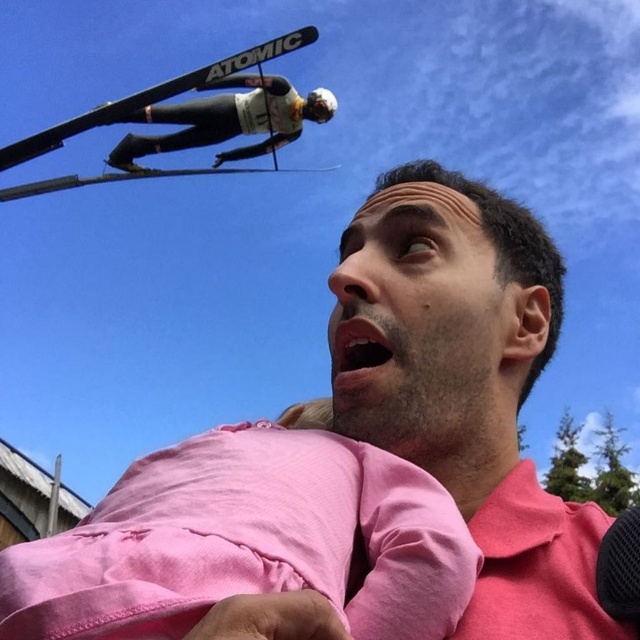
You are an observer looking at the image. You notice two items, the pink cotton shirt at center and the black matte ski suit at upper left. Which item appears narrower in the image?

The pink cotton shirt at center has a lesser width compared to the black matte ski suit at upper left, so it appears narrower.

You are a photographer trying to capture both the pink cotton shirt at center and the black matte ski suit at upper left in the same frame. Given that your camera has a maximum focus range of 30 feet, will you be able to focus on both subjects simultaneously?

The pink cotton shirt at center and the black matte ski suit at upper left are 32.87 feet apart, which exceeds the camera maximum focus range of 30 feet. Therefore, you cannot focus on both subjects simultaneously.